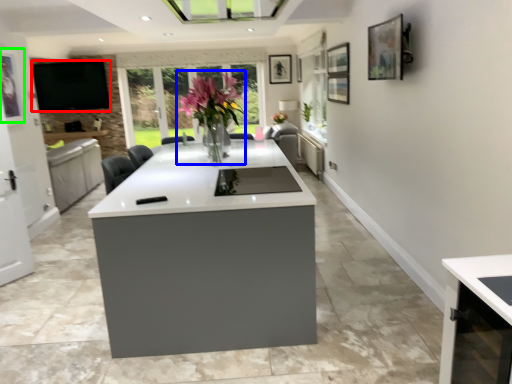
Question: Which object is positioned closest to window screen (highlighted by a red box)? Select from floral arrangement (highlighted by a blue box) and picture frame (highlighted by a green box).

Choices:
 (A) floral arrangement
 (B) picture frame

Answer: (B)